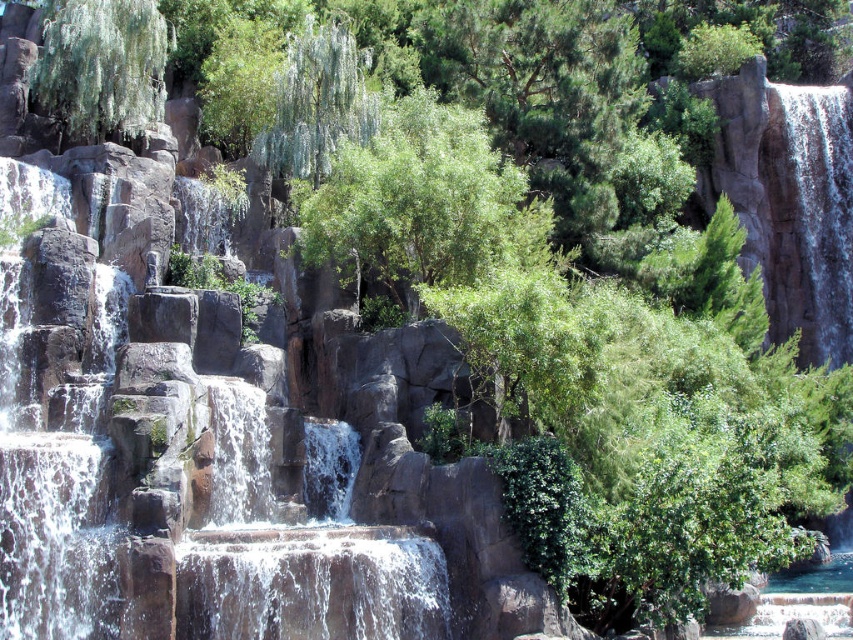
Is green leafy tree at center below white textured water at upper right?

Yes, green leafy tree at center is below white textured water at upper right.

Between point (354, 253) and point (801, 308), which one is positioned behind?

Point (801, 308)

Locate an element on the screen. green leafy tree at center is located at coordinates (416, 202).

Does white textured water at upper right appear under green leafy tree at upper left?

Indeed, white textured water at upper right is positioned under green leafy tree at upper left.

Is white textured water at upper right smaller than green leafy tree at upper left?

No.

Locate an element on the screen. This screenshot has height=640, width=853. white textured water at upper right is located at coordinates (809, 218).

Where is `white textured water at upper right`? white textured water at upper right is located at coordinates (809, 218).

Does green leafy tree at center appear on the left side of green leafy tree at upper left?

In fact, green leafy tree at center is to the right of green leafy tree at upper left.

Image resolution: width=853 pixels, height=640 pixels. I want to click on green leafy tree at center, so click(416, 202).